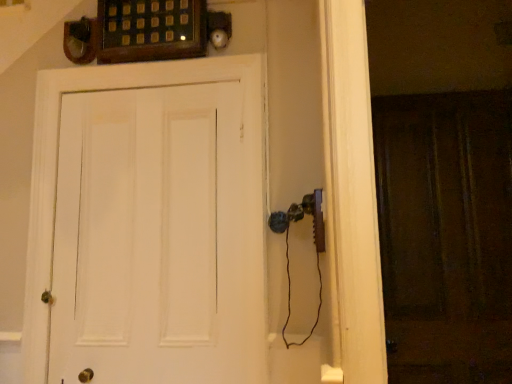
Question: Is white matte door at center to the left of brown wooden screen door at right from the viewer's perspective?

Choices:
 (A) no
 (B) yes

Answer: (B)

Question: From a real-world perspective, is white matte door at center located beneath brown wooden screen door at right?

Choices:
 (A) no
 (B) yes

Answer: (A)

Question: Is white matte door at center closer to camera compared to brown wooden screen door at right?

Choices:
 (A) yes
 (B) no

Answer: (A)

Question: Would you say white matte door at center is a long distance from brown wooden screen door at right?

Choices:
 (A) no
 (B) yes

Answer: (B)

Question: Could brown wooden screen door at right be considered to be inside white matte door at center?

Choices:
 (A) yes
 (B) no

Answer: (B)

Question: From the image's perspective, is white matte door at center located beneath brown wooden screen door at right?

Choices:
 (A) yes
 (B) no

Answer: (B)

Question: Is white matte door at center inside brown wooden screen door at right?

Choices:
 (A) no
 (B) yes

Answer: (A)

Question: From the image's perspective, is brown wooden screen door at right over white matte door at center?

Choices:
 (A) no
 (B) yes

Answer: (A)

Question: Considering the relative positions of brown wooden screen door at right and white matte door at center in the image provided, is brown wooden screen door at right behind white matte door at center?

Choices:
 (A) no
 (B) yes

Answer: (B)

Question: Considering the relative sizes of brown wooden screen door at right and white matte door at center in the image provided, is brown wooden screen door at right smaller than white matte door at center?

Choices:
 (A) no
 (B) yes

Answer: (B)

Question: Can you confirm if brown wooden screen door at right is thinner than white matte door at center?

Choices:
 (A) yes
 (B) no

Answer: (A)

Question: Does brown wooden screen door at right have a greater height compared to white matte door at center?

Choices:
 (A) no
 (B) yes

Answer: (B)

Question: Looking at their shapes, would you say brown wooden screen door at right is wider or thinner than white matte door at center?

Choices:
 (A) thin
 (B) wide

Answer: (A)